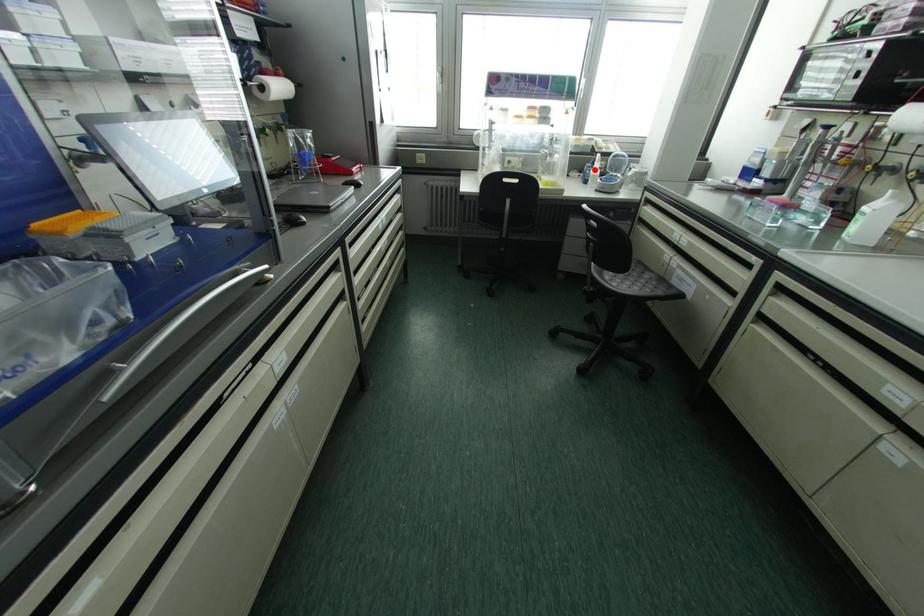
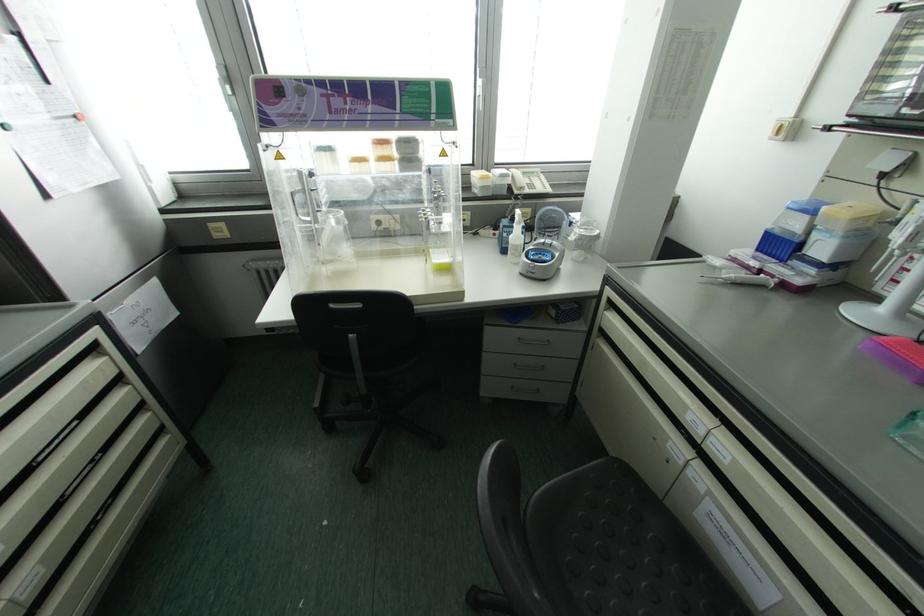
Where in the second image is the point corresponding to the highlighted location from the first image?

(516, 235)